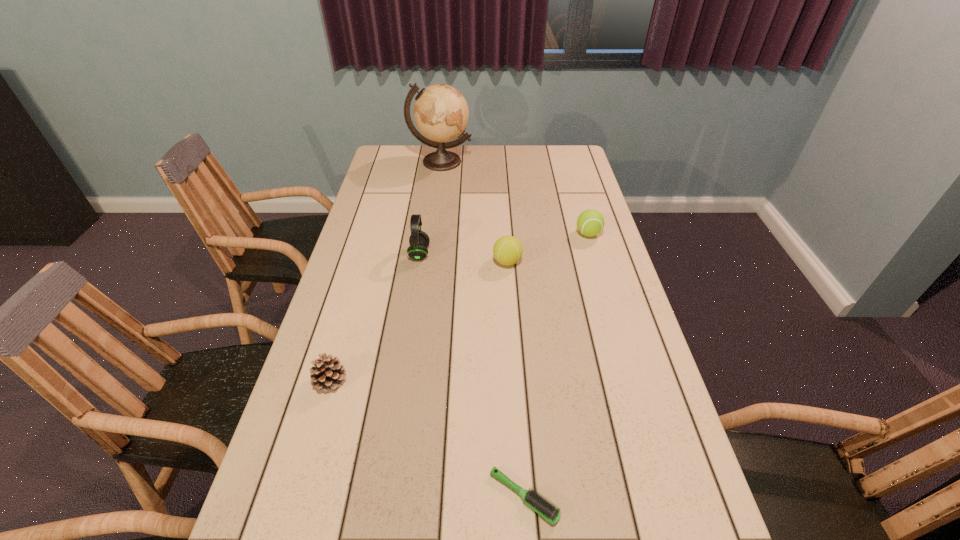
Where is `unoccupied position between the left tennis ball and the right tennis ball`? The height and width of the screenshot is (540, 960). unoccupied position between the left tennis ball and the right tennis ball is located at coordinates (548, 248).

Find the location of a particular element. free space between the fifth shortest object and the nearest object is located at coordinates (471, 375).

The image size is (960, 540). What are the coordinates of `free space that is in between the nearest object and the fifth shortest object` in the screenshot? It's located at (471, 375).

Identify the location of free space between the second nearest object and the headset. This screenshot has height=540, width=960. (375, 317).

Where is `empty space that is in between the nearer tennis ball and the headset`? The height and width of the screenshot is (540, 960). empty space that is in between the nearer tennis ball and the headset is located at coordinates (464, 258).

Identify the location of vacant area that lies between the pinecone and the fifth nearest object. (460, 307).

Where is `object that is the third nearest to the nearest object`? The height and width of the screenshot is (540, 960). object that is the third nearest to the nearest object is located at coordinates (419, 241).

Locate which object ranks fourth in proximity to the fifth farthest object. Please provide its 2D coordinates. Your answer should be formatted as a tuple, i.e. [(x, y)], where the tuple contains the x and y coordinates of a point satisfying the conditions above.

[(590, 222)]

Locate an element on the screen. The height and width of the screenshot is (540, 960). free space that satisfies the following two spatial constraints: 1. on the ear cups of the headset; 2. on the left side of the shortest object is located at coordinates (381, 496).

Locate an element on the screen. The height and width of the screenshot is (540, 960). free space that satisfies the following two spatial constraints: 1. on the front-facing side of the globe; 2. on the ear cups of the second tallest object is located at coordinates (428, 254).